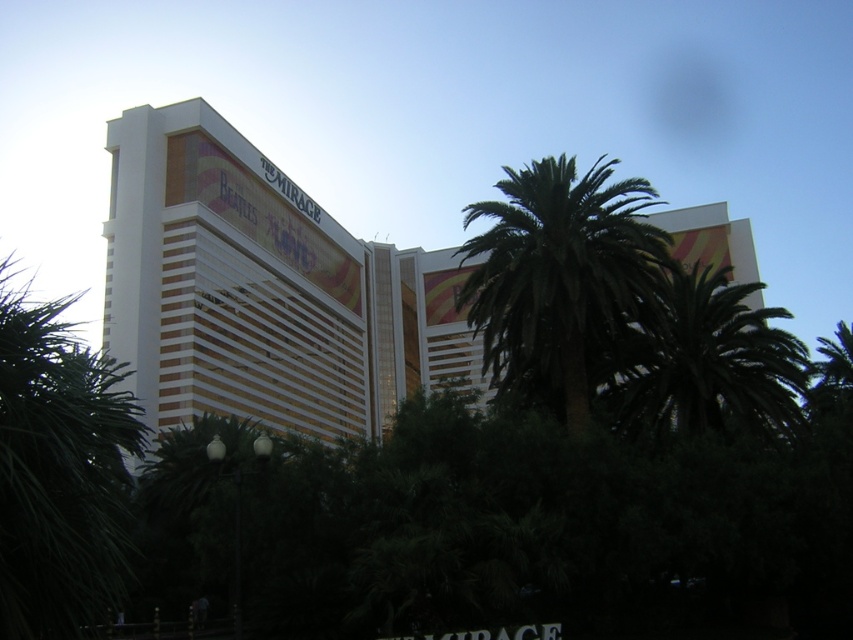
Question: Considering the real-world distances, which object is farthest from the green leafy palm at left?

Choices:
 (A) white glossy building at center
 (B) green leafy palm tree at center

Answer: (A)

Question: Observing the image, what is the correct spatial positioning of green leafy palm at left in reference to green leafy palm at center?

Choices:
 (A) below
 (B) above

Answer: (A)

Question: Can you confirm if white glossy building at center is bigger than green leafy palm at left?

Choices:
 (A) no
 (B) yes

Answer: (B)

Question: Which point is farther from the camera taking this photo?

Choices:
 (A) (432, 259)
 (B) (664, 424)
 (C) (537, 172)

Answer: (A)

Question: Which of the following is the farthest from the observer?

Choices:
 (A) (489, 244)
 (B) (796, 368)
 (C) (480, 380)
 (D) (76, 540)

Answer: (C)

Question: Where is white glossy building at center located in relation to green leafy palm tree at center in the image?

Choices:
 (A) left
 (B) right

Answer: (A)